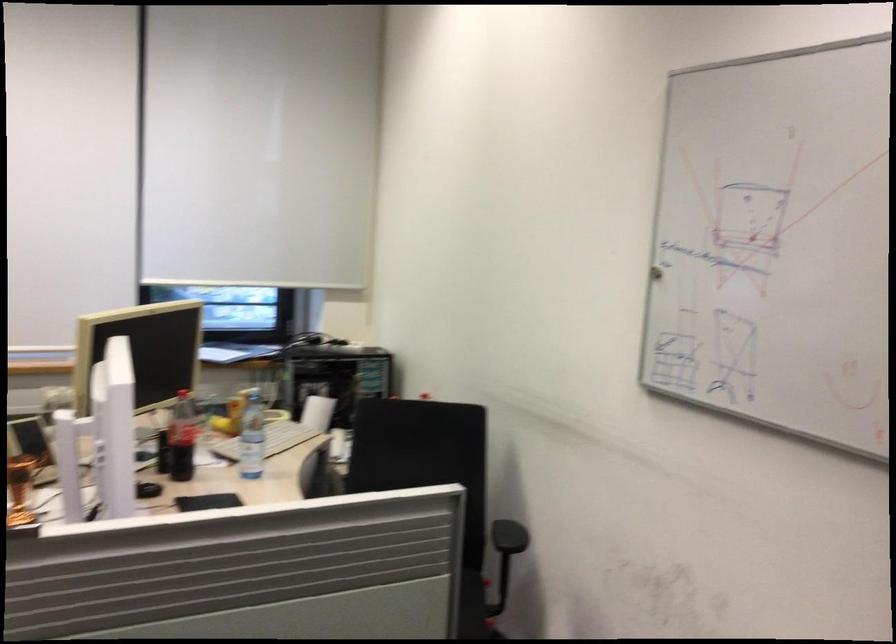
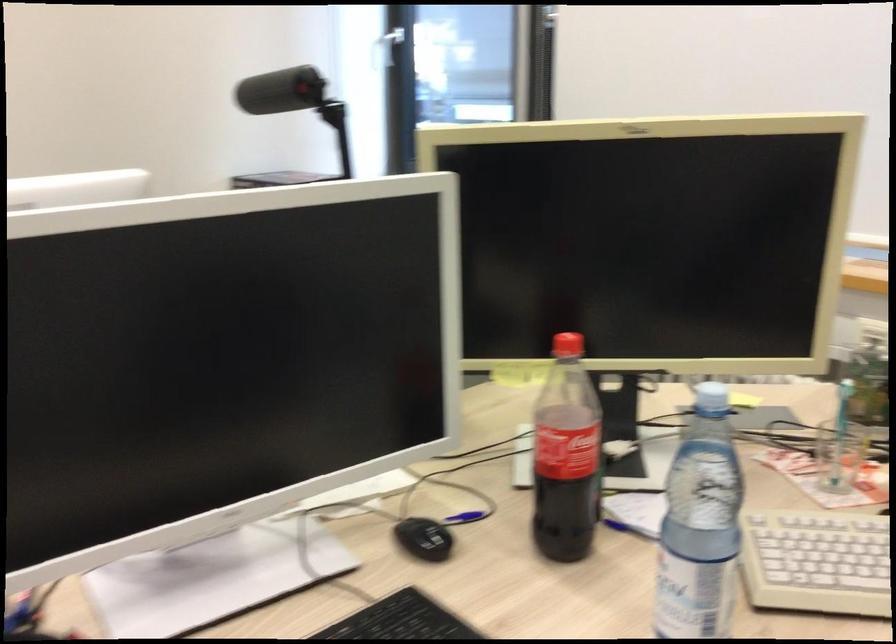
In the second image, find the point that corresponds to point 235,448 in the first image.

(815, 562)